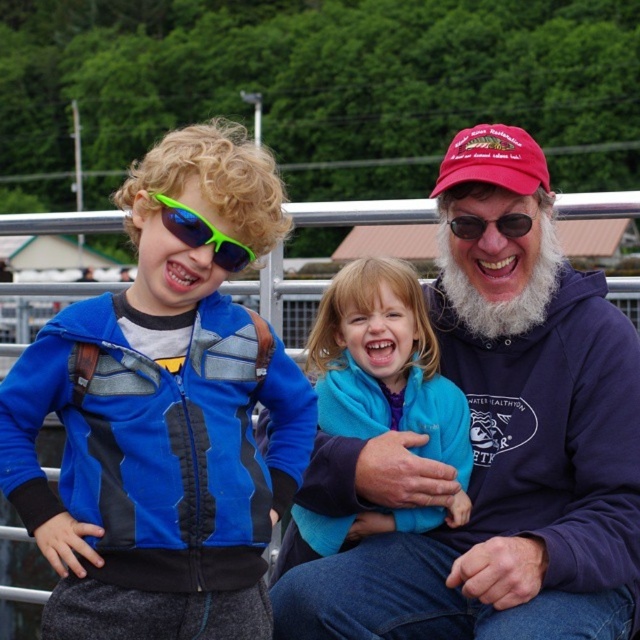
You are standing in front of the scene and want to pick up the matte blue jacket at left and the green matte sunglasses at upper center. Which object is easier to reach without moving your position?

The matte blue jacket at left is closer to the viewer than the green matte sunglasses at upper center, so it is easier to reach without moving your position.

You are a photographer trying to capture a clear photo of the neon green plastic goggles at left. However, the matte blue jacket at left is blocking your view. Can you move around to the left side of the jacket to get an unobstructed shot?

The neon green plastic goggles at left is behind the matte blue jacket at left, so moving to the left side of the matte blue jacket at left might allow you to see around it and capture the goggles without obstruction.